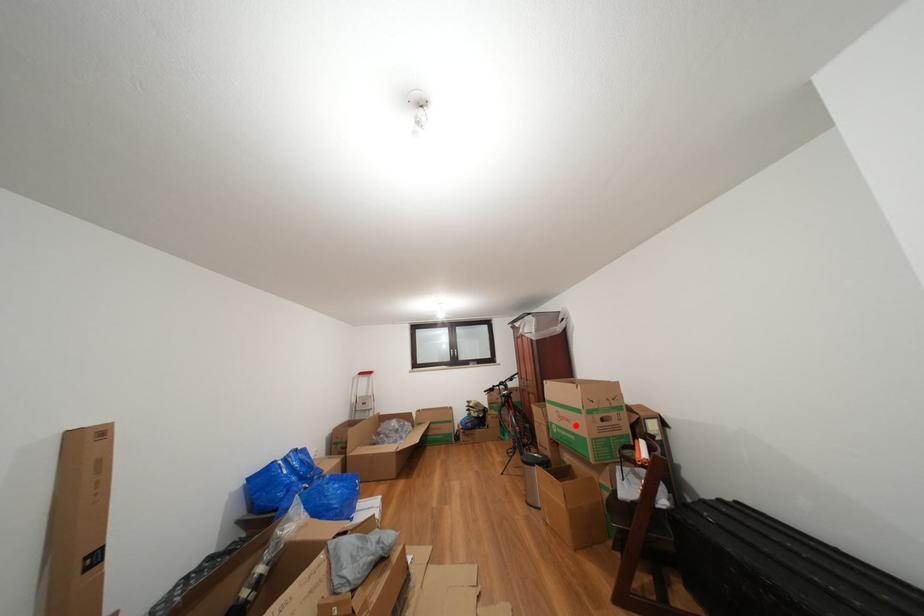
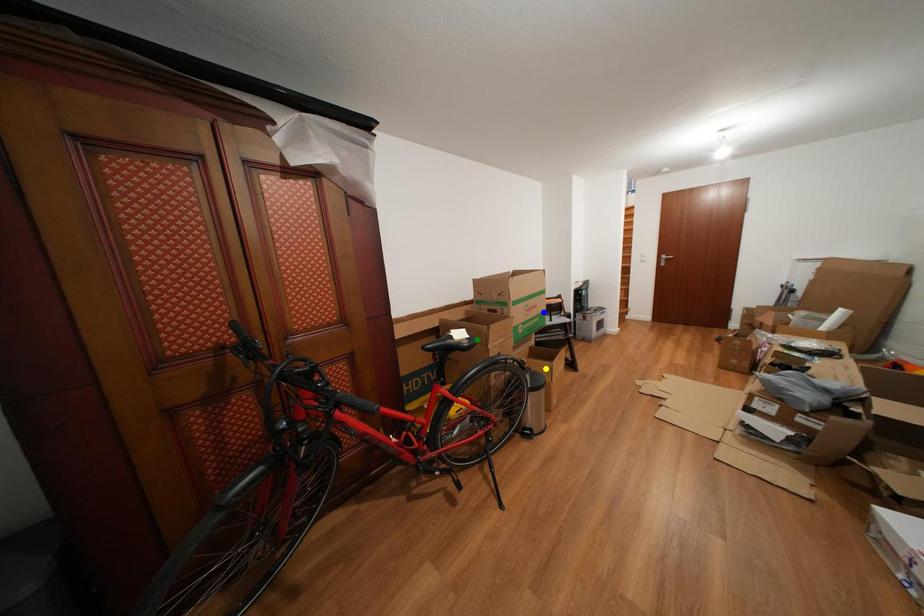
Question: I am providing you with two images of the same scene from different viewpoints. A red point is marked on the first image. You are given multiple points on the second image. Which point in image 2 is actually the same real-world point as the red point in image 1?

Choices:
 (A) green point
 (B) yellow point
 (C) blue point

Answer: (C)